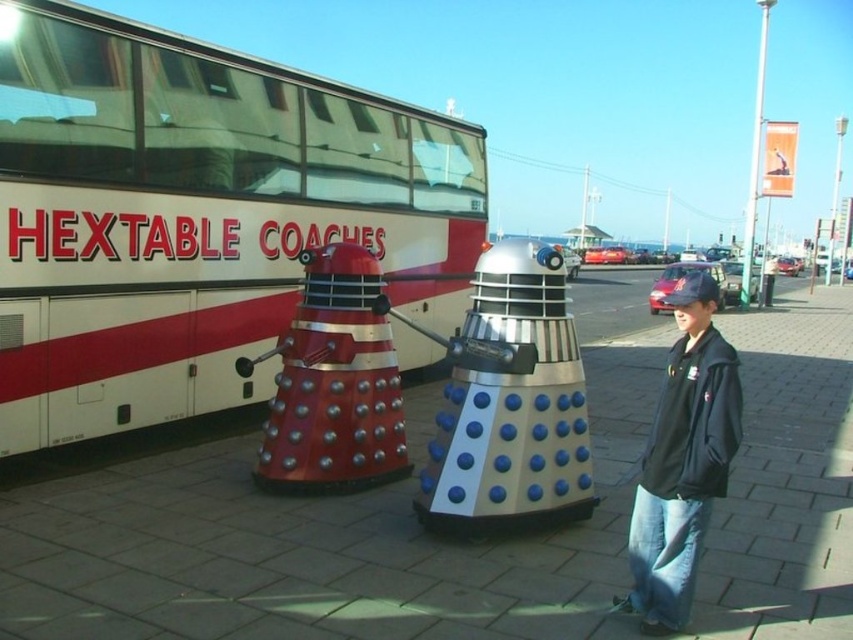
Between metallic red dalek at center and black leather jacket at lower right, which one has less height?

black leather jacket at lower right

Does metallic red dalek at center have a greater width compared to black leather jacket at lower right?

Yes, metallic red dalek at center is wider than black leather jacket at lower right.

Is point (305, 308) closer to camera compared to point (699, 483)?

No, it is behind (699, 483).

Identify the location of metallic red dalek at center. (334, 381).

What do you see at coordinates (194, 216) in the screenshot? The image size is (853, 640). I see `white/red painted coach at upper left` at bounding box center [194, 216].

Does white/red painted coach at upper left have a lesser width compared to black leather jacket at lower right?

No.

Who is more distant from viewer, (x=154, y=348) or (x=704, y=529)?

Positioned behind is point (x=154, y=348).

Find the location of a particular element. The image size is (853, 640). white/red painted coach at upper left is located at coordinates (194, 216).

Can you confirm if silver metallic dalek at center is positioned above metallic red dalek at center?

Actually, silver metallic dalek at center is below metallic red dalek at center.

Is point (529, 241) positioned behind point (283, 445)?

That is False.

Find the location of a particular element. The height and width of the screenshot is (640, 853). silver metallic dalek at center is located at coordinates (511, 403).